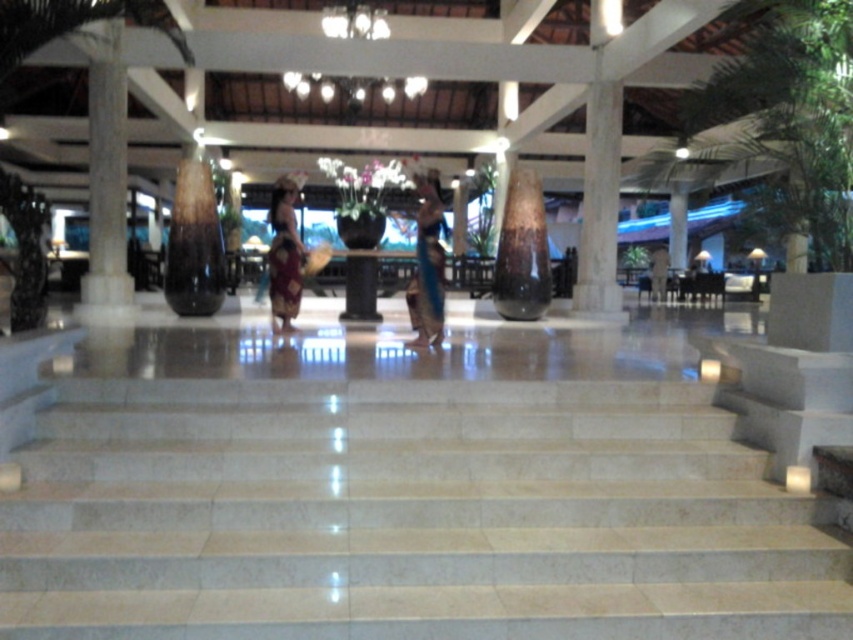
Based on the photo, you are a guest entering the lobby and need to decide whether to place your blue silk dress at center near the white marble pillar at left. Considering their sizes, will the pillar block the dress from being seen by someone standing at the entrance?

The white marble pillar at left has a larger size compared to blue silk dress at center. Since the pillar is bigger, it might block the view of the dress if placed too close, depending on their exact positions.

You are standing at the entrance of the lobby and want to walk straight ahead towards the main area. Is there an obstacle in your path? Please refer to the white marble pillar at center to determine this.

The white marble pillar at center is located at point (599, 204), which would be directly in your path if you walk straight ahead from the entrance. Therefore, there is an obstacle in your path.